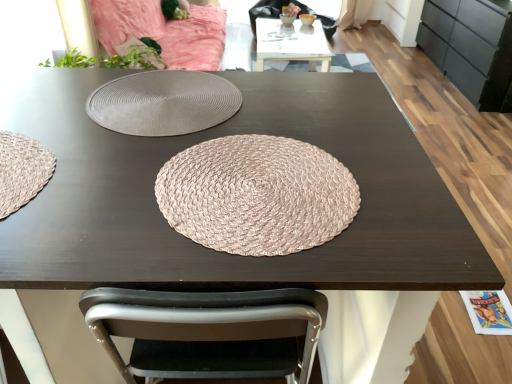
Question: Based on their sizes in the image, would you say white glossy table at upper center is bigger or smaller than pink woven mat at center?

Choices:
 (A) big
 (B) small

Answer: (A)

Question: Is white glossy table at upper center inside or outside of pink woven mat at center?

Choices:
 (A) outside
 (B) inside

Answer: (A)

Question: Which is nearer to the white glossy table at upper center?

Choices:
 (A) pink woven mat at center
 (B) matte black dresser at right
 (C) matte gray placemat at center

Answer: (B)

Question: Estimate the real-world distances between objects in this image. Which object is closer to the matte gray placemat at center?

Choices:
 (A) pink woven mat at center
 (B) white glossy table at upper center
 (C) matte black dresser at right

Answer: (A)